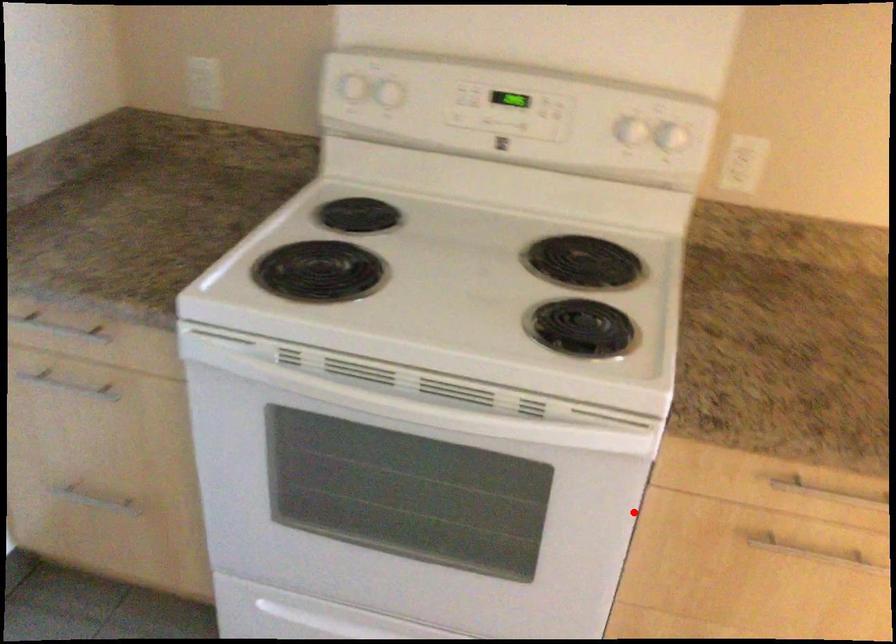
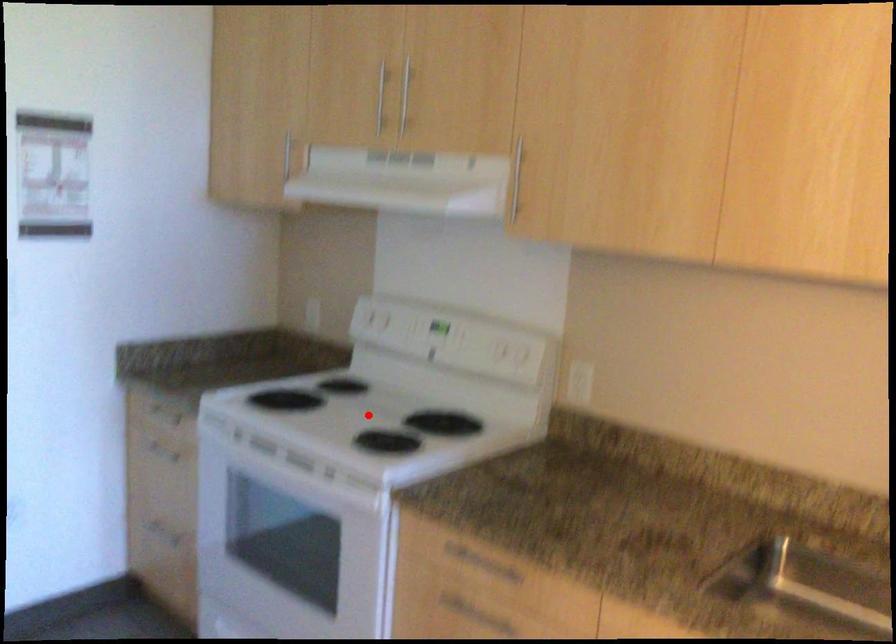
I am providing you with two images of the same scene from different viewpoints. A red point is marked on the first image and another point is marked on the second image. Is the red point in image1 aligned with the point shown in image2?

No